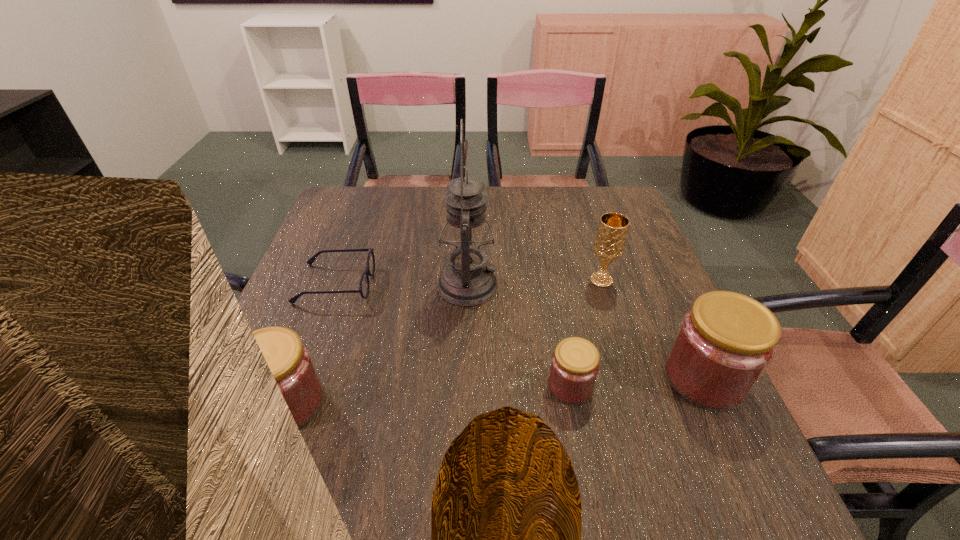
At what (x,y) coordinates should I click in order to perform the action: click on empty location between the fifth tallest object and the shortest object. Please return your answer as a coordinate pair (x, y). Image resolution: width=960 pixels, height=540 pixels. Looking at the image, I should click on (453, 335).

Where is `vacant area that lies between the shortest object and the shortest jam`? vacant area that lies between the shortest object and the shortest jam is located at coordinates (453, 335).

This screenshot has width=960, height=540. I want to click on vacant space that is in between the spectacles and the oil lamp, so click(401, 285).

Identify the location of free space between the fifth object from left to right and the fifth tallest object. The width and height of the screenshot is (960, 540). (586, 333).

Where is `vacant region between the leftmost jam and the rightmost object`? vacant region between the leftmost jam and the rightmost object is located at coordinates (496, 390).

Find the location of a particular element. Image resolution: width=960 pixels, height=540 pixels. unoccupied area between the shortest object and the rightmost jam is located at coordinates (520, 331).

At what (x,y) coordinates should I click in order to perform the action: click on vacant space that is in between the rightmost object and the second jam from right to left. Please return your answer as a coordinate pair (x, y). Image resolution: width=960 pixels, height=540 pixels. Looking at the image, I should click on (637, 382).

Locate which object ranks fourth in proximity to the rightmost object. Please provide its 2D coordinates. Your answer should be formatted as a tuple, i.e. [(x, y)], where the tuple contains the x and y coordinates of a point satisfying the conditions above.

[(364, 286)]

Locate which object ranks second in proximity to the chalice. Please provide its 2D coordinates. Your answer should be formatted as a tuple, i.e. [(x, y)], where the tuple contains the x and y coordinates of a point satisfying the conditions above.

[(467, 279)]

I want to click on jam that is the nearest to the spectacles, so click(290, 360).